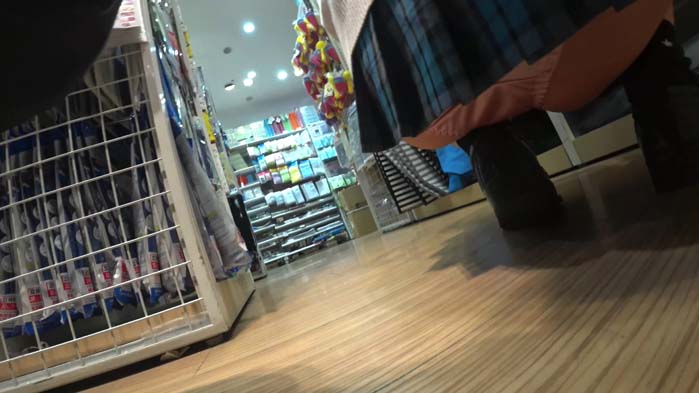
Find the location of `wood floor`. wood floor is located at coordinates (438, 330).